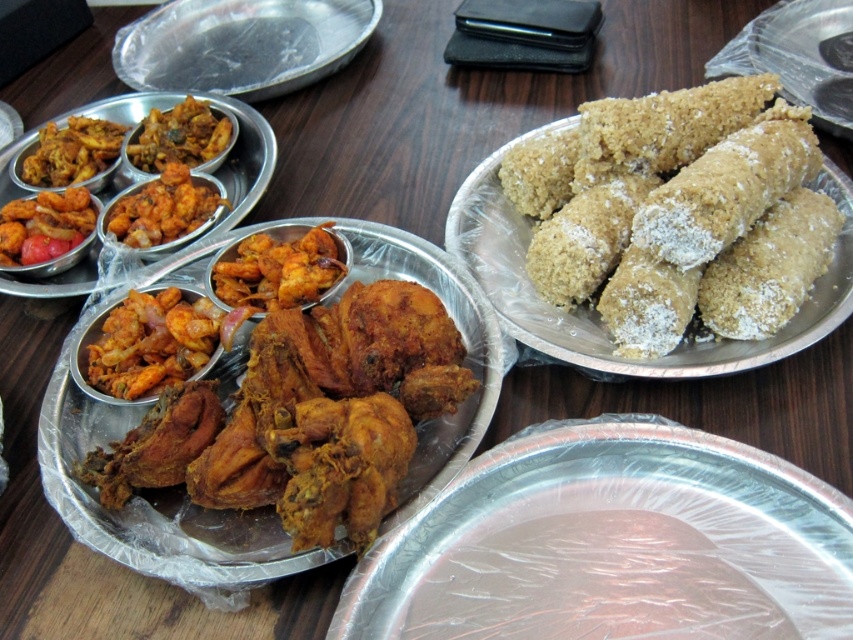
Is orange-brown crispy cauliflower at center-left thinner than shiny red tomato at upper left?

No, orange-brown crispy cauliflower at center-left is not thinner than shiny red tomato at upper left.

Which is in front, point (149, 340) or point (78, 224)?

Point (149, 340)

I want to click on orange-brown crispy cauliflower at center-left, so click(x=151, y=342).

Is orange-brown crispy cauliflower at center-left shorter than matte orange curry at center?

No, orange-brown crispy cauliflower at center-left is not shorter than matte orange curry at center.

Consider the image. Which of these two, orange-brown crispy cauliflower at center-left or matte orange curry at center, stands shorter?

matte orange curry at center

Locate an element on the screen. The height and width of the screenshot is (640, 853). orange-brown crispy cauliflower at center-left is located at coordinates (151, 342).

Is silver metallic tray at upper left taller than orange-brown crispy cauliflower at center-left?

Yes.

This screenshot has height=640, width=853. I want to click on silver metallic tray at upper left, so click(241, 44).